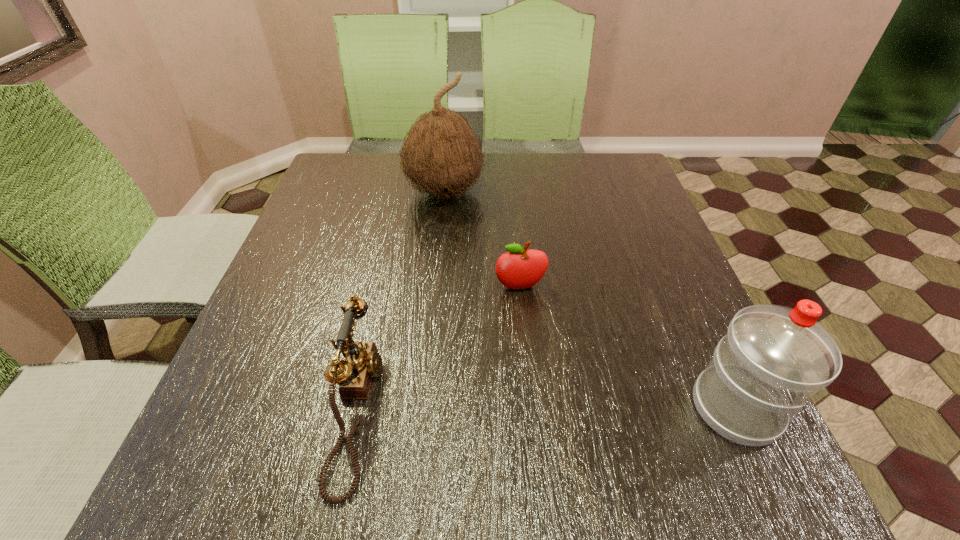
Image resolution: width=960 pixels, height=540 pixels. What are the coordinates of `telephone` in the screenshot? It's located at (362, 362).

This screenshot has height=540, width=960. Identify the location of the rightmost object. click(x=773, y=358).

This screenshot has width=960, height=540. What are the coordinates of `the second tallest object` in the screenshot? It's located at (773, 358).

The height and width of the screenshot is (540, 960). I want to click on apple, so click(519, 268).

Identify the location of the second farthest object. The width and height of the screenshot is (960, 540). (519, 268).

Where is `the tallest object`? This screenshot has height=540, width=960. the tallest object is located at coordinates (441, 155).

I want to click on coconut, so 441,155.

You are a GUI agent. You are given a task and a screenshot of the screen. Output one action in this format:
    pyautogui.click(x=<x>, y=<y>)
    Task: Click on the vacant space located 0.170m on the front-facing side of the telephone
    Image resolution: width=960 pixels, height=540 pixels.
    Given the screenshot: What is the action you would take?
    pyautogui.click(x=478, y=409)

Image resolution: width=960 pixels, height=540 pixels. Identify the location of vacant space located 0.080m on the front-facing side of the third object from left to right. (528, 324).

Image resolution: width=960 pixels, height=540 pixels. In order to click on vacant space located on the front-facing side of the third object from left to right in this screenshot , I will do `click(538, 371)`.